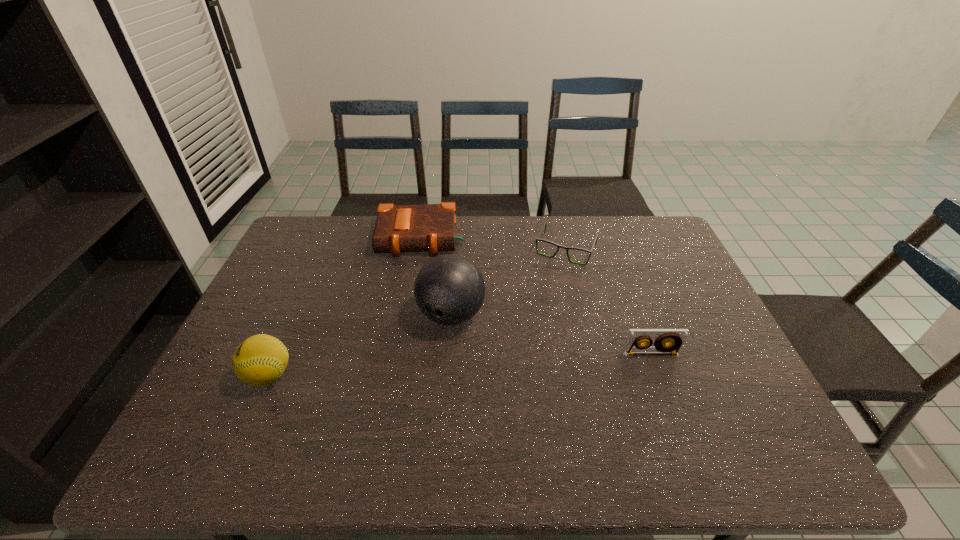
Locate an element on the screen. This screenshot has height=540, width=960. object that is at the near edge is located at coordinates (260, 360).

This screenshot has height=540, width=960. Find the location of `object present at the left edge`. object present at the left edge is located at coordinates coord(260,360).

Locate an element on the screen. This screenshot has width=960, height=540. object located in the right edge section of the desktop is located at coordinates (676, 337).

You are a GUI agent. You are given a task and a screenshot of the screen. Output one action in this format:
    pyautogui.click(x=<x>, y=<y>)
    Task: Click on the object that is at the near left corner
    This screenshot has width=960, height=540.
    Given the screenshot: What is the action you would take?
    (x=260, y=360)

This screenshot has height=540, width=960. In order to click on vacant space at the far edge of the desktop in this screenshot , I will do `click(492, 249)`.

The width and height of the screenshot is (960, 540). I want to click on vacant space at the near edge, so click(653, 404).

This screenshot has width=960, height=540. Identify the location of blank space at the left edge of the desktop. (302, 283).

Locate an element on the screen. vacant space at the right edge of the desktop is located at coordinates (660, 321).

Where is `free space at the far left corner of the desktop`? Image resolution: width=960 pixels, height=540 pixels. free space at the far left corner of the desktop is located at coordinates click(x=299, y=220).

This screenshot has width=960, height=540. I want to click on vacant area at the near left corner of the desktop, so [260, 406].